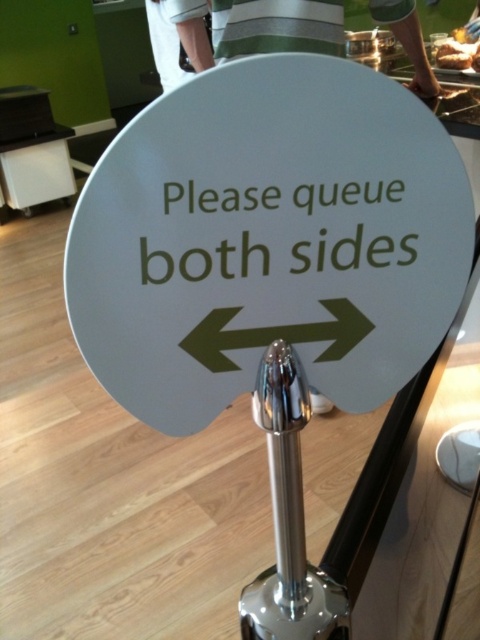
You are a customer in a cafeteria and want to see both the white glossy sign at center and the brown bread at upper right. Which object will appear larger in your view?

The white glossy sign at center will appear larger because it is closer to the viewer than the brown bread at upper right.

You are a customer in a cafeteria and want to place a freshly baked brown bread at upper right on the white glossy sign at center. Can you do this without touching the sign?

The white glossy sign at center is 1.93 meters away from the brown bread at upper right. Since the distance is too far, you cannot place the brown bread at upper right on the white glossy sign at center without touching it.